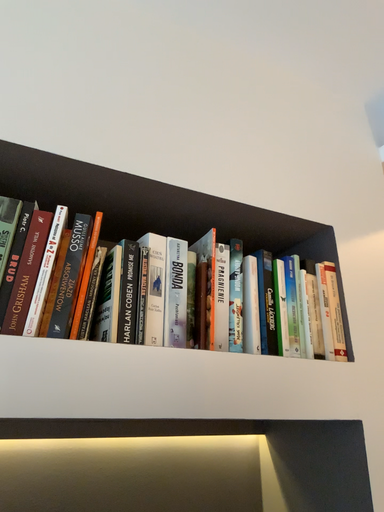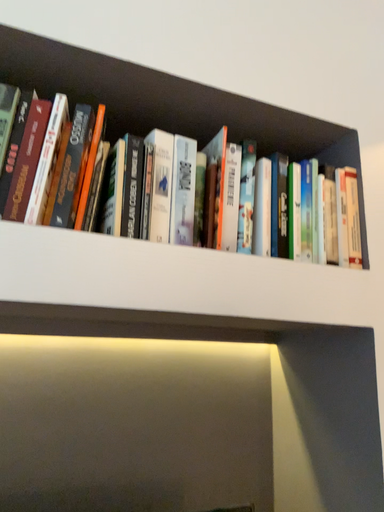
Question: Which way did the camera rotate in the video?

Choices:
 (A) rotated downward
 (B) rotated upward

Answer: (A)